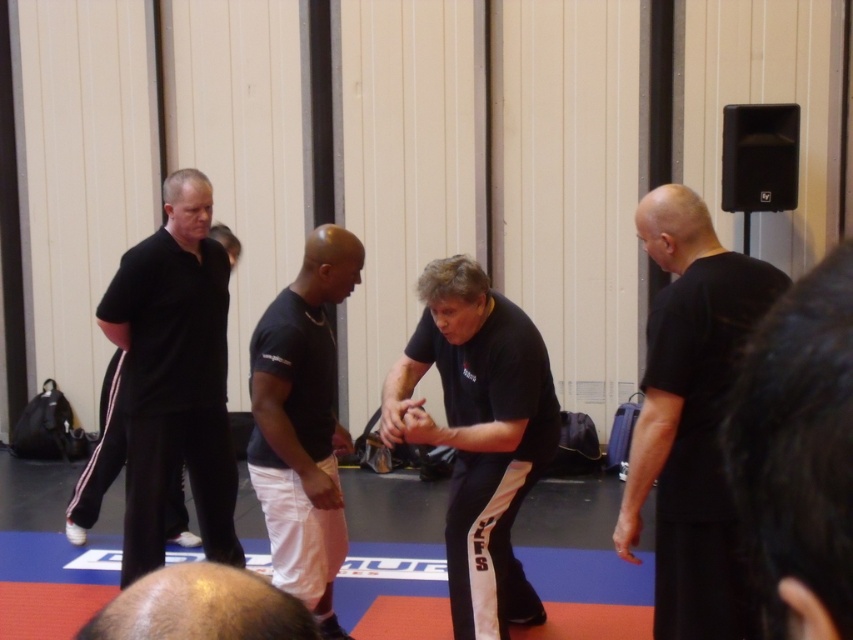
Does point (462, 602) lie in front of point (323, 225)?

That is True.

Identify the location of black matte pants at center. This screenshot has width=853, height=640. (479, 435).

Does point (386, 433) come farther from viewer compared to point (292, 472)?

That is False.

Find the location of `black matte pants at center`. black matte pants at center is located at coordinates (479, 435).

Who is higher up, black matte hair at upper right or black matte pants at left?

Positioned higher is black matte hair at upper right.

Which of these two, black matte hair at upper right or black matte pants at left, stands taller?

With more height is black matte pants at left.

Identify the location of black matte hair at upper right. The image size is (853, 640). (798, 452).

Which is more to the right, black cotton shirt at center or bald head at center?

From the viewer's perspective, bald head at center appears more on the right side.

Which is below, black cotton shirt at center or bald head at center?

black cotton shirt at center is lower down.

Is point (334, 634) positioned in front of point (241, 612)?

No, it is behind (241, 612).

Image resolution: width=853 pixels, height=640 pixels. Identify the location of black cotton shirt at center. (302, 422).